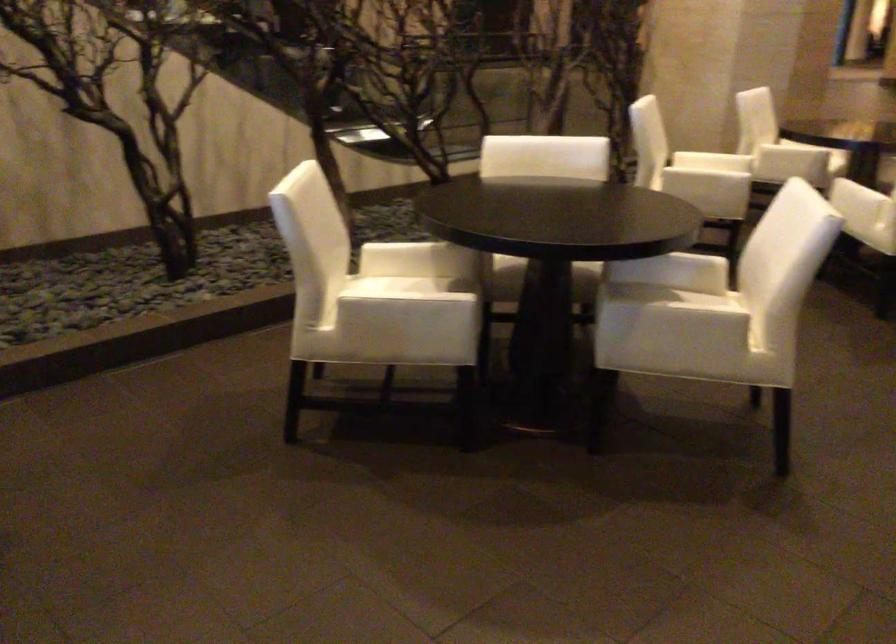
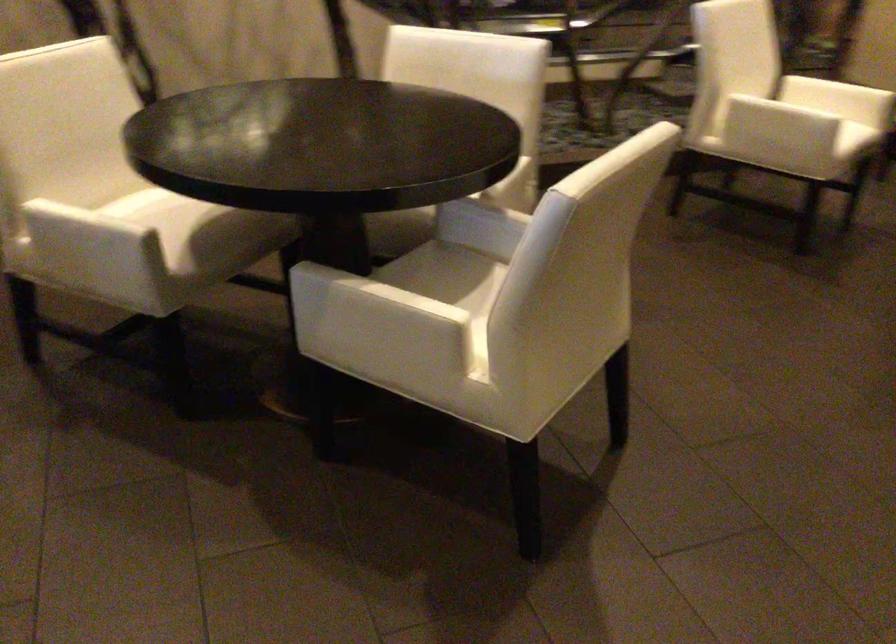
In a continuous first-person perspective shot, in which direction is the camera moving?

The movement direction of the cameraman is right, forward.